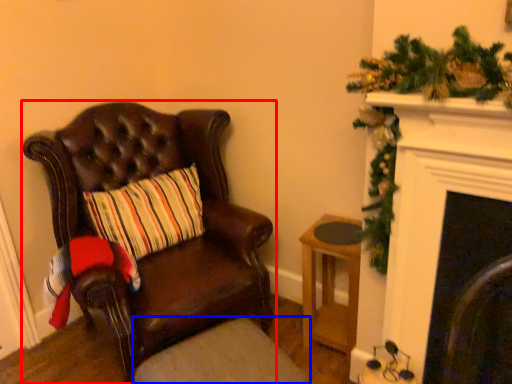
Question: Among these objects, which one is farthest to the camera, chair (highlighted by a red box) or footrest (highlighted by a blue box)?

Choices:
 (A) chair
 (B) footrest

Answer: (A)